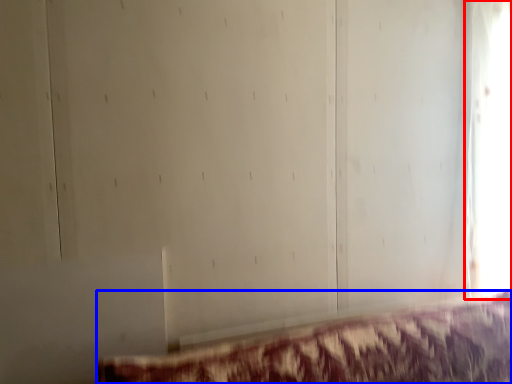
Question: Among these objects, which one is nearest to the camera, window (highlighted by a red box) or furniture (highlighted by a blue box)?

Choices:
 (A) window
 (B) furniture

Answer: (B)